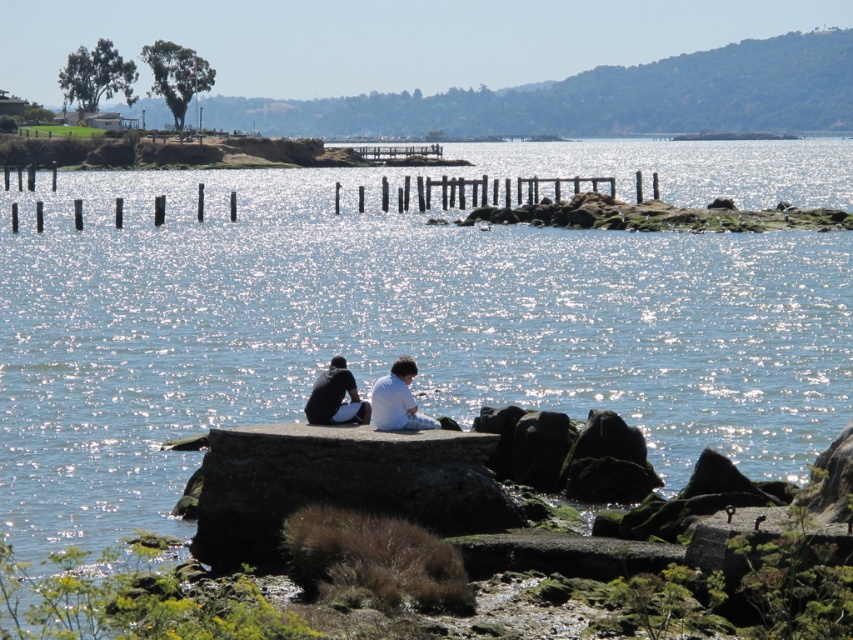
Does white fabric couple at center have a larger size compared to dark gray fabric shirt at lower center?

Indeed, white fabric couple at center has a larger size compared to dark gray fabric shirt at lower center.

Can you confirm if white fabric couple at center is positioned above dark gray fabric shirt at lower center?

No.

Who is more forward, (402,376) or (329,371)?

Point (402,376) is more forward.

Locate an element on the screen. This screenshot has width=853, height=640. white fabric couple at center is located at coordinates (376, 397).

Is white fabric couple at center positioned at the back of white matte shirt at center?

No, white fabric couple at center is in front of white matte shirt at center.

Can you confirm if white fabric couple at center is taller than white matte shirt at center?

Indeed, white fabric couple at center has a greater height compared to white matte shirt at center.

Identify the location of white fabric couple at center. (376, 397).

Is white matte shirt at center to the left of dark gray fabric shirt at lower center from the viewer's perspective?

No, white matte shirt at center is not to the left of dark gray fabric shirt at lower center.

Who is more forward, (387, 419) or (312, 410)?

Point (387, 419)

The width and height of the screenshot is (853, 640). I want to click on white matte shirt at center, so click(x=397, y=400).